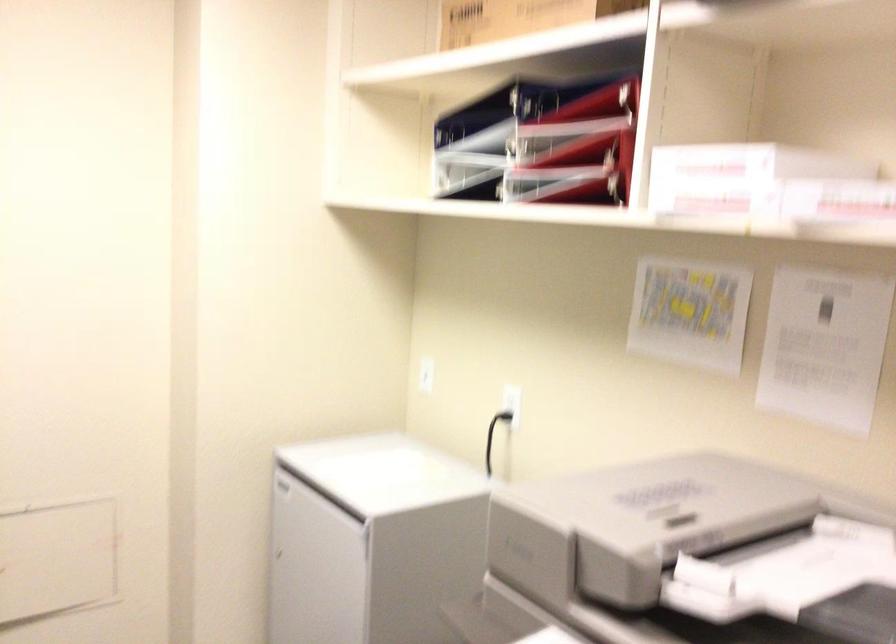
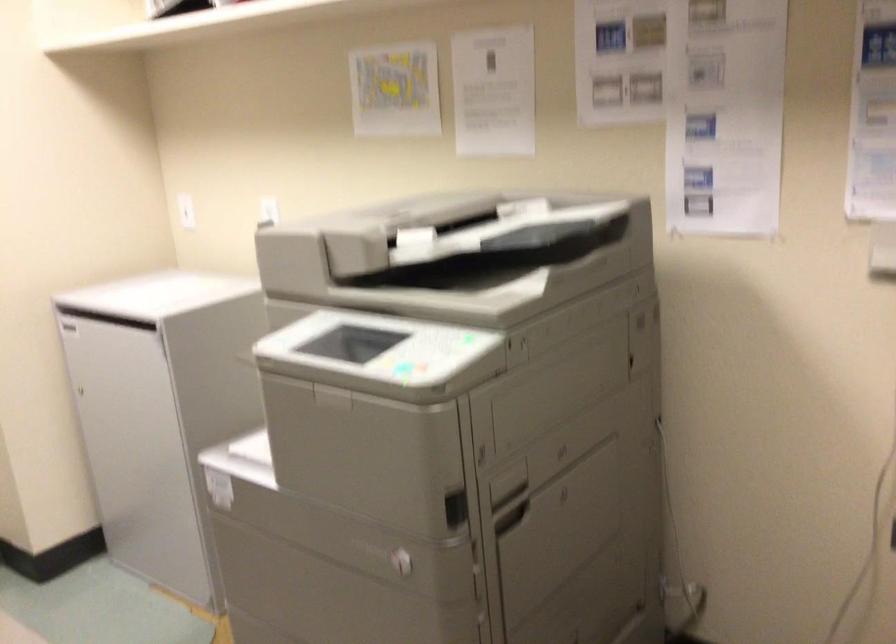
Locate, in the second image, the point that corresponds to point (279, 560) in the first image.

(85, 392)